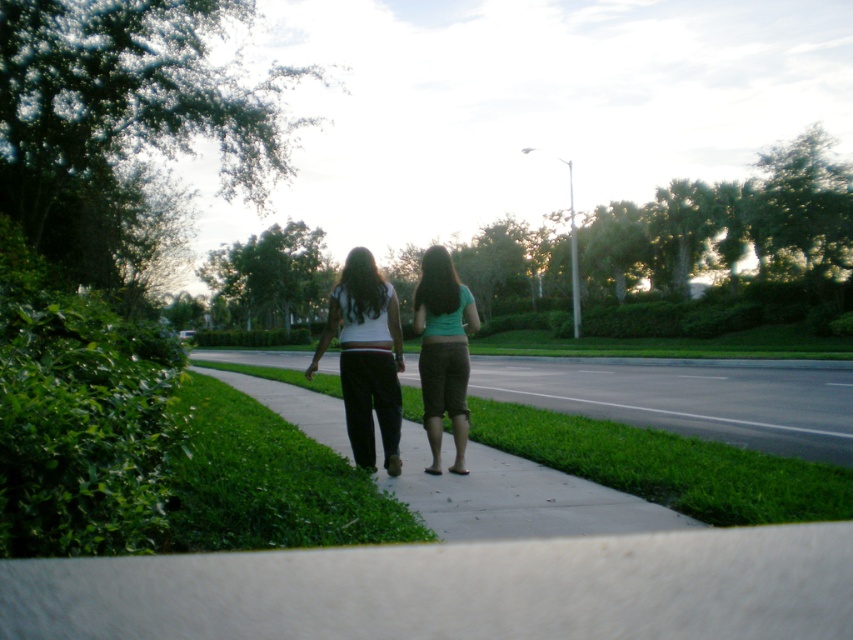
You are a photographer setting up a tripod on the smooth concrete sidewalk at center. You notice the white matte pants at center nearby. Based on their sizes, which object would you estimate is taller?

The white matte pants at center are taller than the smooth concrete sidewalk at center.

You are a photographer trying to capture a closeup shot of both the white matte pants at center and the green fabric pants at center in the scene. Given that your camera has a minimum focus distance of 60 centimeters, can you position yourself to take the photo without moving the subjects?

The white matte pants at center and green fabric pants at center are 65.85 centimeters apart from each other, which is greater than the camera minimum focus distance of 60 centimeters. Therefore, you can position yourself to take the photo without moving the subjects.